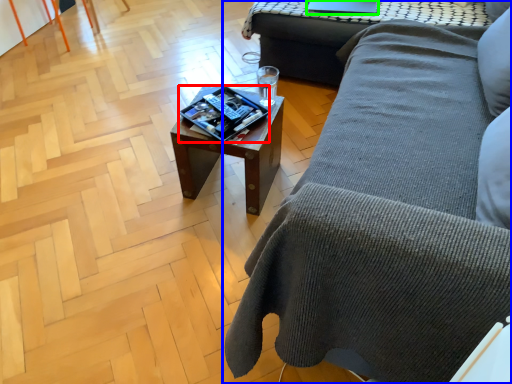
Question: Which is nearer to the magazine (highlighted by a red box)? studio couch (highlighted by a blue box) or laptop (highlighted by a green box).

Choices:
 (A) studio couch
 (B) laptop

Answer: (A)